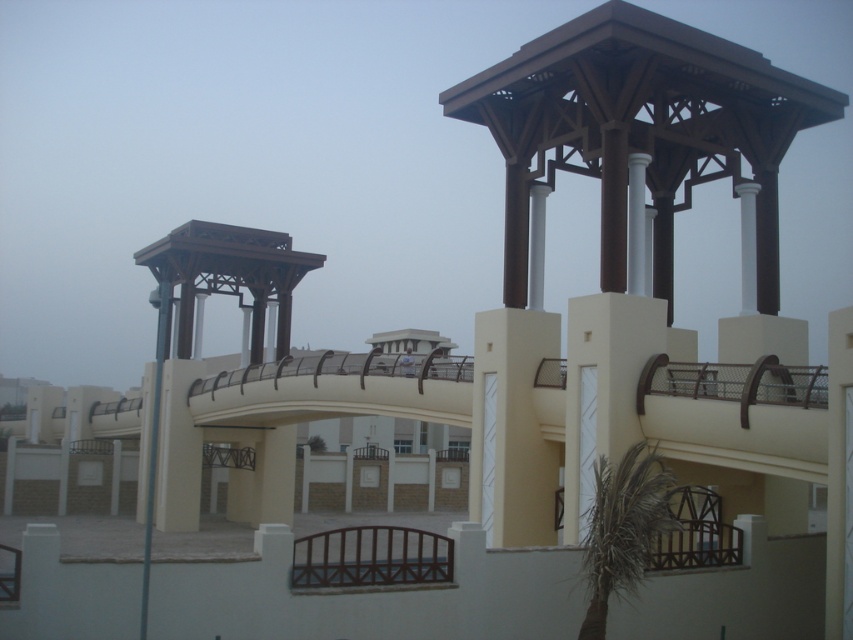
You are standing at the entrance of the architectural structure and notice the green leafy palm tree at lower right and the metallic pole at left. Which object takes up more area in the scene?

The metallic pole at left takes up more area in the scene than the green leafy palm tree at lower right because the green leafy palm tree at lower right occupies less space than metallic pole at left.

You are standing at the base of the green leafy palm tree at lower right and want to reach the metallic pole at left. The path between them is straight. If your maximum walking distance is 10 meters, can you reach the pole without getting tired?

The green leafy palm tree at lower right is 11.68 meters away from metallic pole at left. Since your maximum walking distance is 10 meters, you cannot reach the pole without getting tired.

You are standing at the camera position and want to take a photo of the green leafy palm tree at lower right. If your camera has a maximum focus range of 20 meters, will you need to adjust your position to capture it clearly?

The green leafy palm tree at lower right is 23.16 meters away from the camera, which exceeds the maximum focus range of 20 meters. You will need to move closer to ensure the palm tree is in focus.